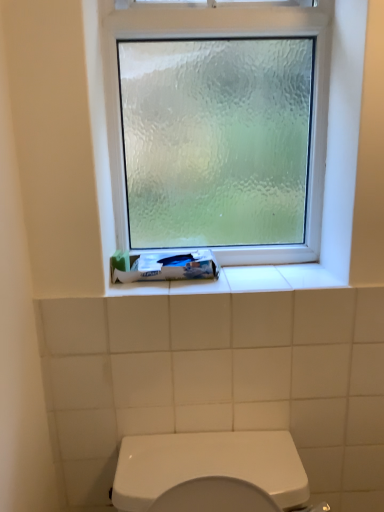
Question: Is white matte tube at lower center in front of or behind frosted glass window at upper center in the image?

Choices:
 (A) behind
 (B) front

Answer: (A)

Question: From the image's perspective, is white matte tube at lower center located above or below frosted glass window at upper center?

Choices:
 (A) above
 (B) below

Answer: (B)

Question: From a real-world perspective, is white matte tube at lower center above or below frosted glass window at upper center?

Choices:
 (A) below
 (B) above

Answer: (A)

Question: From a real-world perspective, is frosted glass window at upper center physically located above or below white matte tube at lower center?

Choices:
 (A) above
 (B) below

Answer: (A)

Question: In the image, is frosted glass window at upper center on the left side or the right side of white matte tube at lower center?

Choices:
 (A) left
 (B) right

Answer: (B)

Question: From the image's perspective, is frosted glass window at upper center above or below white matte tube at lower center?

Choices:
 (A) above
 (B) below

Answer: (A)

Question: In terms of size, does frosted glass window at upper center appear bigger or smaller than white matte tube at lower center?

Choices:
 (A) big
 (B) small

Answer: (A)